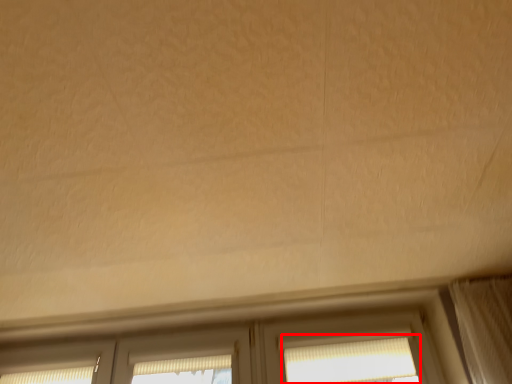
Question: From the image's perspective, where is window (annotated by the red box) located relative to screen door?

Choices:
 (A) above
 (B) below

Answer: (A)